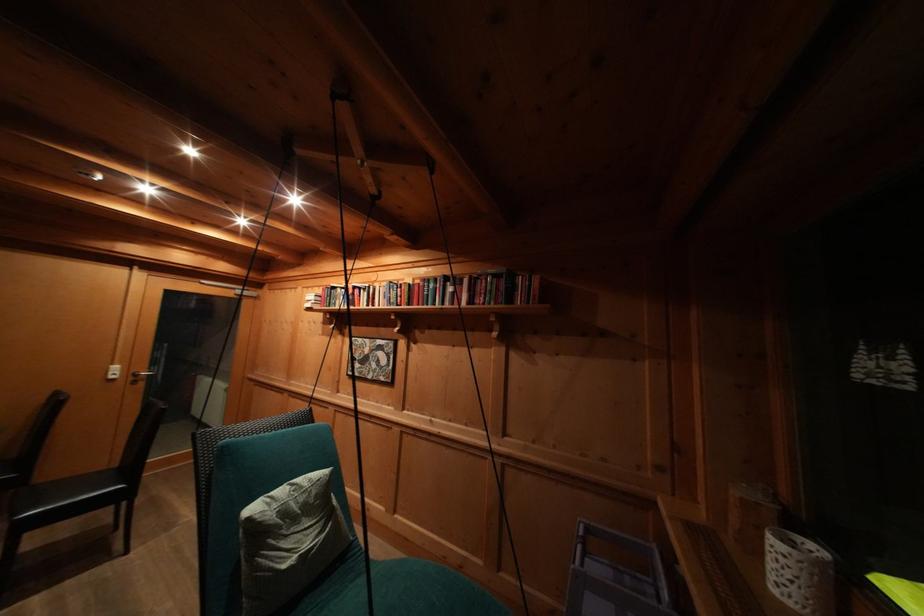
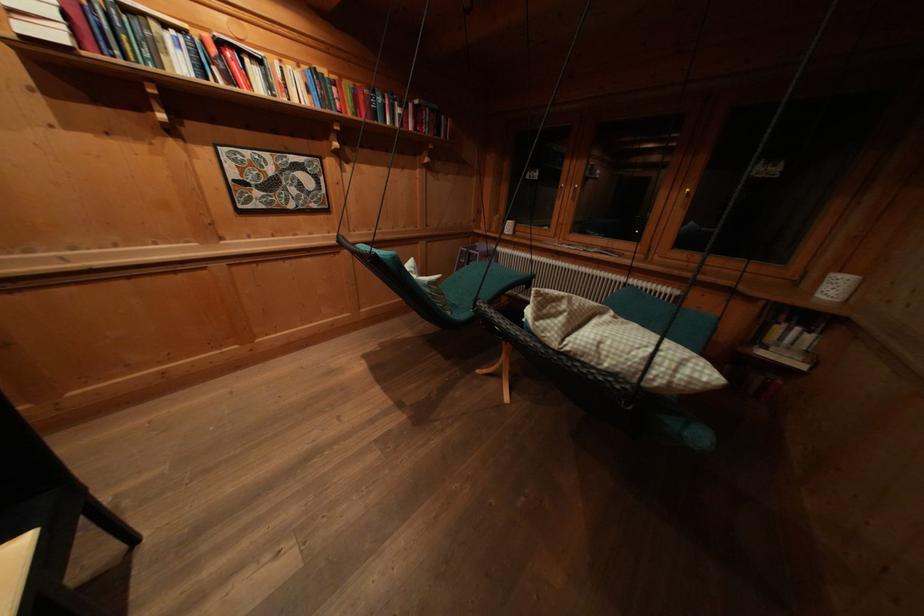
Locate, in the second image, the point that corresponds to [360,293] in the first image.

(225, 47)